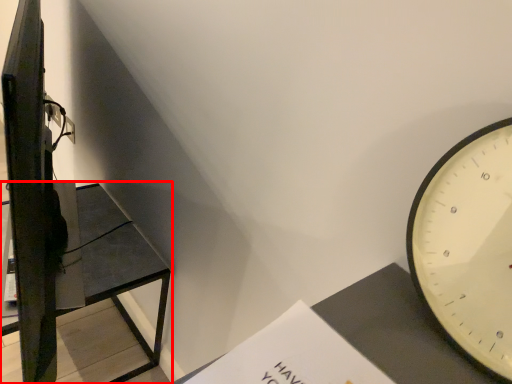
Question: Observing the image, what is the correct spatial positioning of furniture (annotated by the red box) in reference to paperback book?

Choices:
 (A) left
 (B) right

Answer: (A)